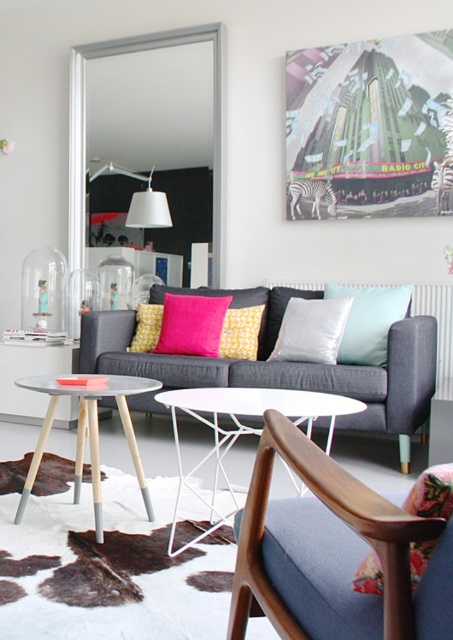
You are a delivery person who needs to place a large package that is 30 inches wide between the dark gray fabric couch at center and the white wire side table at center. Can the package fit in that space?

The distance between the dark gray fabric couch at center and the white wire side table at center is 25.87 inches, which is shorter than the package width of 30 inches. Therefore, the package cannot fit in that space.

You are standing in the living room and want to place a small plant between the two points, point (288, 385) and point (216, 410). Based on their positions, which point should the plant be closer to in order to be placed between them?

The plant should be closer to point (216, 410) because point (288, 385) is behind point (216, 410).